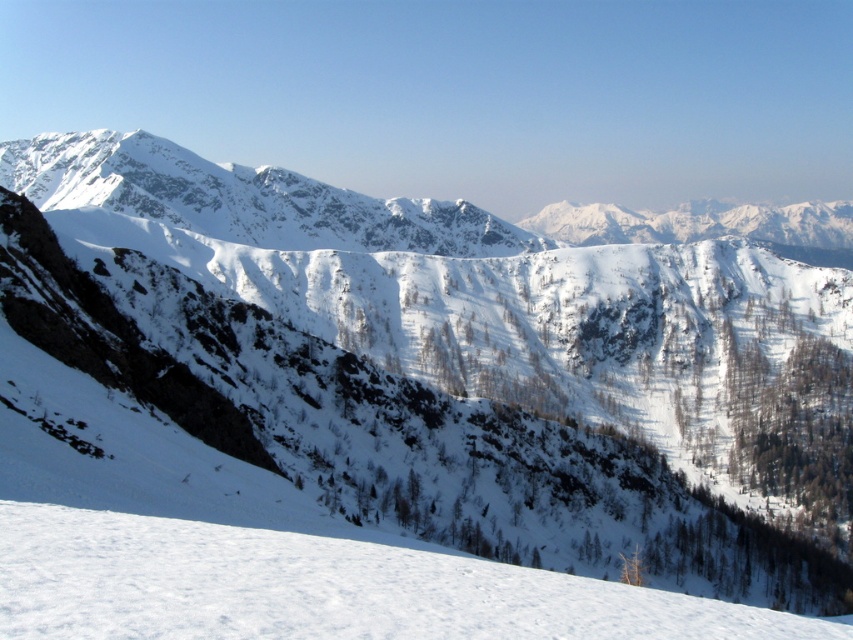
Question: Among these objects, which one is farthest from the camera?

Choices:
 (A) white snow-covered mountain range at upper center
 (B) white snow at lower center

Answer: (A)

Question: Which point is closer to the camera?

Choices:
 (A) white snow at lower center
 (B) white snow-covered mountain range at upper center

Answer: (A)

Question: Is white snow at lower center to the left of white snow-covered mountain range at upper center from the viewer's perspective?

Choices:
 (A) no
 (B) yes

Answer: (B)

Question: Which point is farther to the camera?

Choices:
 (A) (170, 193)
 (B) (308, 547)

Answer: (A)

Question: Does white snow at lower center have a larger size compared to white snow-covered mountain range at upper center?

Choices:
 (A) yes
 (B) no

Answer: (B)

Question: Is white snow at lower center positioned before white snow-covered mountain range at upper center?

Choices:
 (A) no
 (B) yes

Answer: (B)